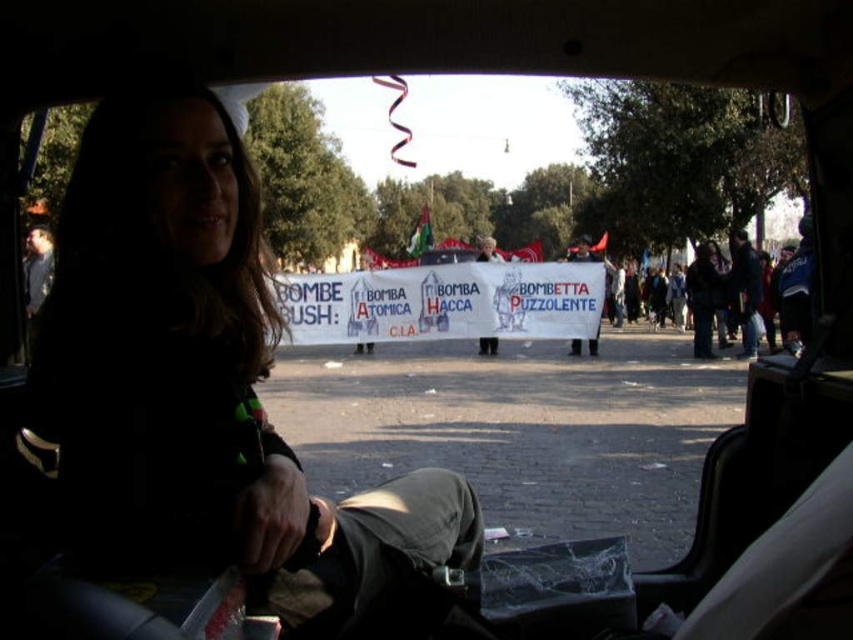
The height and width of the screenshot is (640, 853). What do you see at coordinates (202, 381) in the screenshot?
I see `dark hair at center` at bounding box center [202, 381].

Who is more forward, (248, 355) or (587, 257)?

Point (248, 355) is more forward.

Identify the location of dark hair at center. The height and width of the screenshot is (640, 853). (202, 381).

Identify the location of dark hair at center. (x=202, y=381).